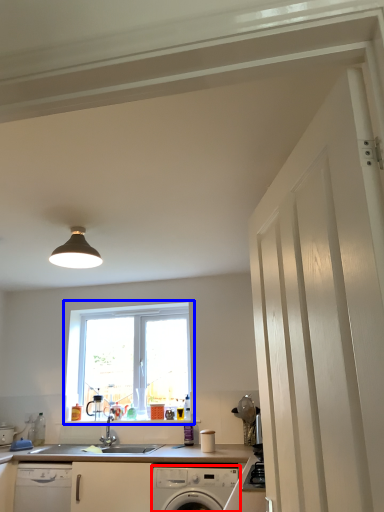
Question: Which object appears closest to the camera in this image, home appliance (highlighted by a red box) or window (highlighted by a blue box)?

Choices:
 (A) home appliance
 (B) window

Answer: (A)